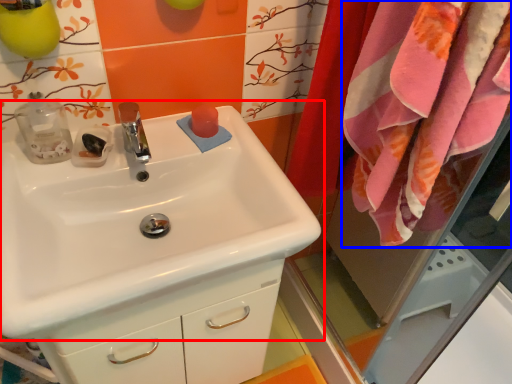
Question: Which point is closer to the camera, sink (highlighted by a red box) or bath towel (highlighted by a blue box)?

Choices:
 (A) sink
 (B) bath towel

Answer: (B)